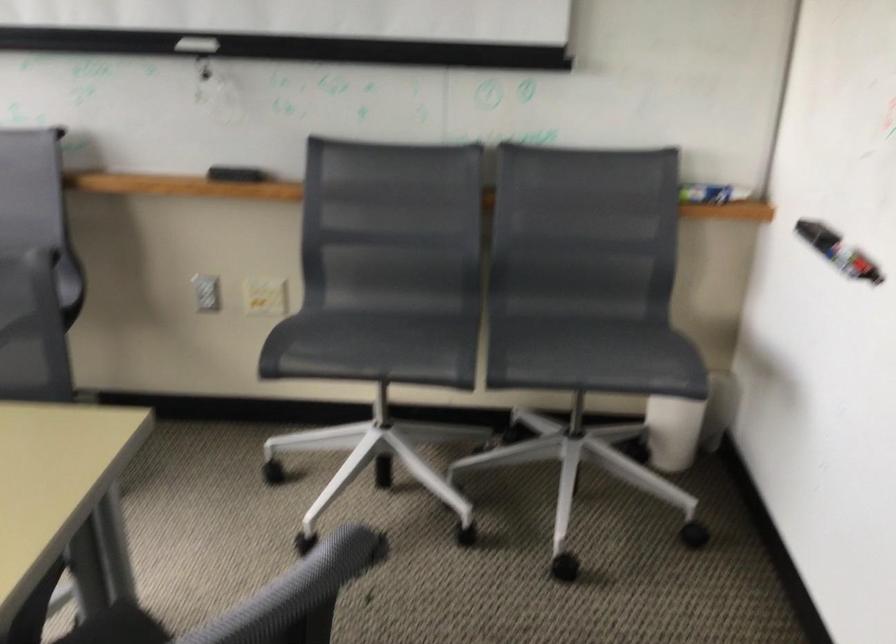
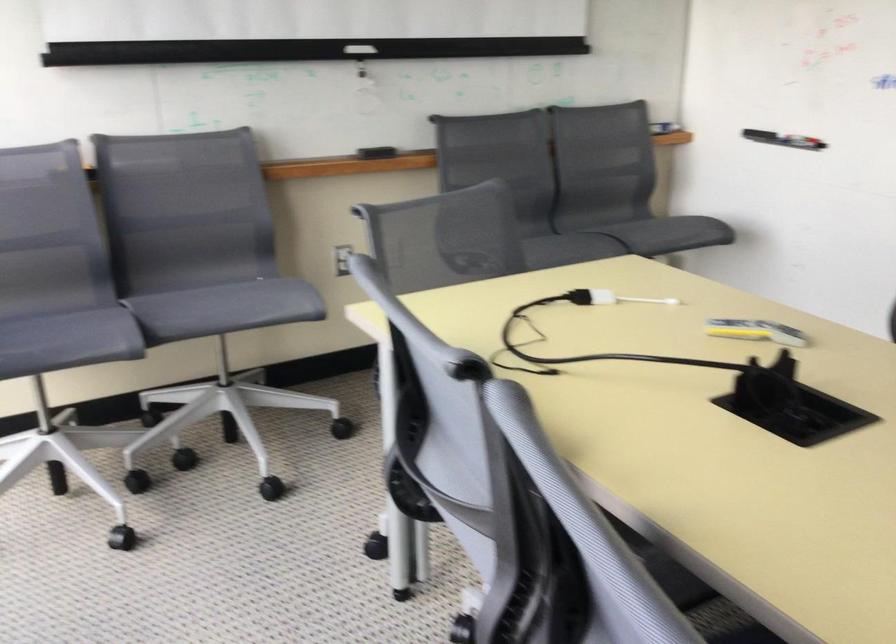
Find the pixel in the second image that matches point 805,257 in the first image.

(782, 138)